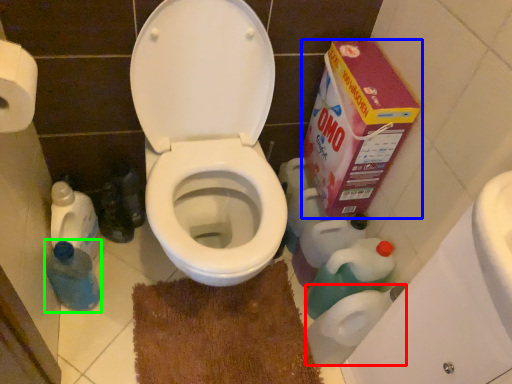
Question: Estimate the real-world distances between objects in this image. Which object is farther from toilet paper (highlighted by a red box), cardboard box (highlighted by a blue box) or cleaning product (highlighted by a green box)?

Choices:
 (A) cardboard box
 (B) cleaning product

Answer: (B)